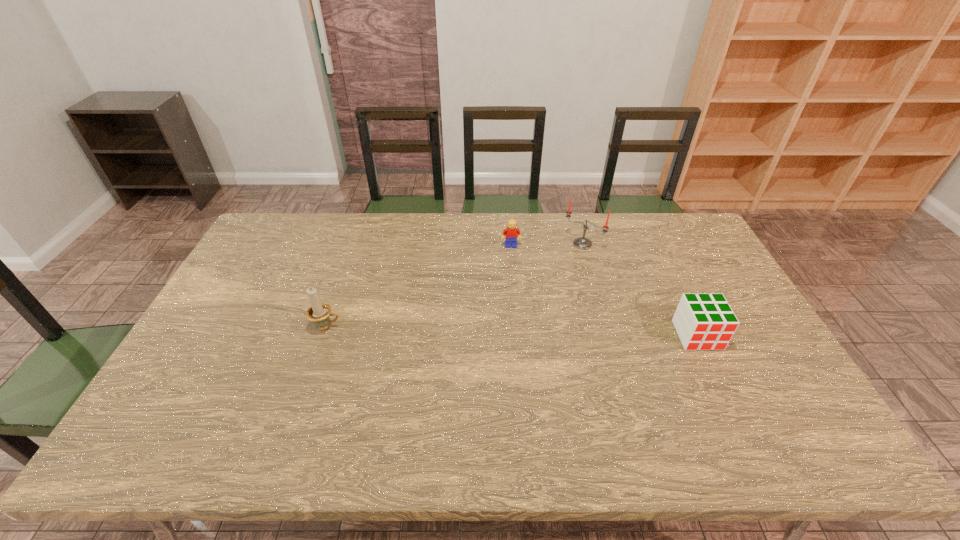
Point out which object is positioned as the second nearest to the rightmost object. Please provide its 2D coordinates. Your answer should be formatted as a tuple, i.e. [(x, y)], where the tuple contains the x and y coordinates of a point satisfying the conditions above.

[(510, 232)]